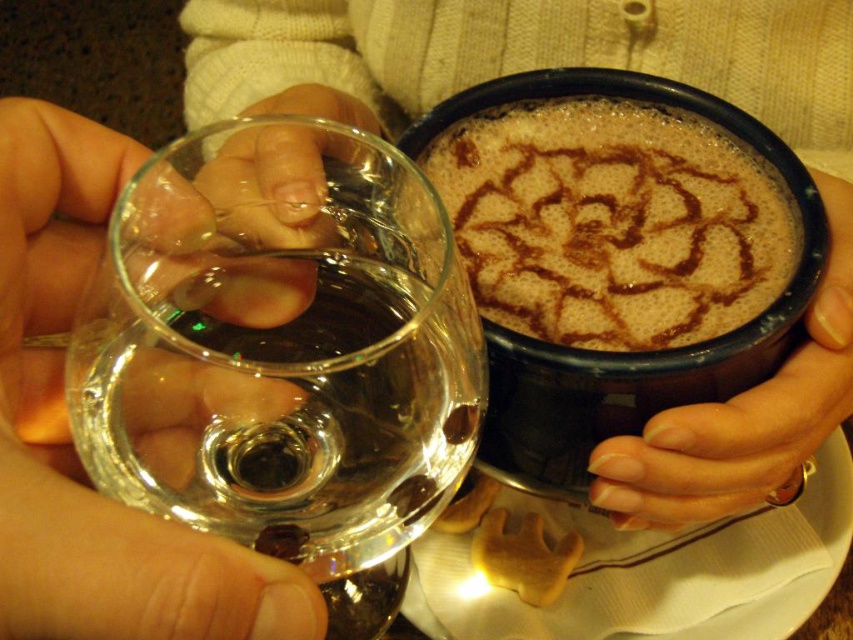
You are a barista trying to place a small 3 cm wide coaster between the brown frothy coffee at upper center and the nail polish on fingernails at right. Can the coaster fit between them?

The distance between the brown frothy coffee at upper center and the nail polish on fingernails at right is 4.27 centimeters. Since the coaster is 3 cm wide, it can fit between them as there is enough space.

Consider the image. You are a photographer adjusting your camera to focus on two points in the image. The first point is the glass of water held by the left hand at point coordinates (635,64), and the second point is the coffee cup held by the right hand at coordinates (848,388). Which point should you focus on first if you want to ensure both are in focus without moving the camera?

You should focus on point (635,64) first because it is closer to the viewer than point (848,388), allowing the camera to adjust depth of field to include both points in focus.